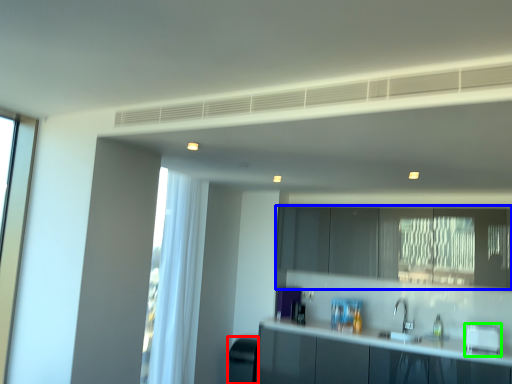
Question: Which object is positioned closest to appliance (highlighted by a red box)? Select from cabinetry (highlighted by a blue box) and appliance (highlighted by a green box).

Choices:
 (A) cabinetry
 (B) appliance

Answer: (A)